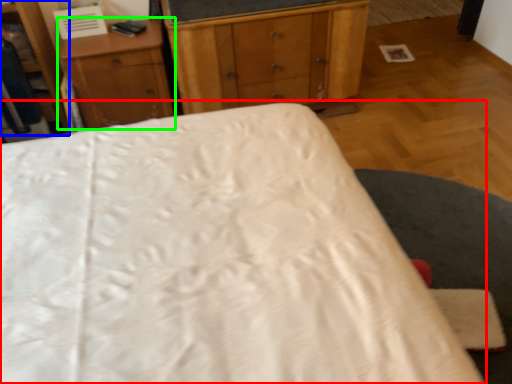
Question: Considering the real-world distances, which object is farthest from bed (highlighted by a red box)? dresser (highlighted by a blue box) or nightstand (highlighted by a green box)?

Choices:
 (A) dresser
 (B) nightstand

Answer: (A)